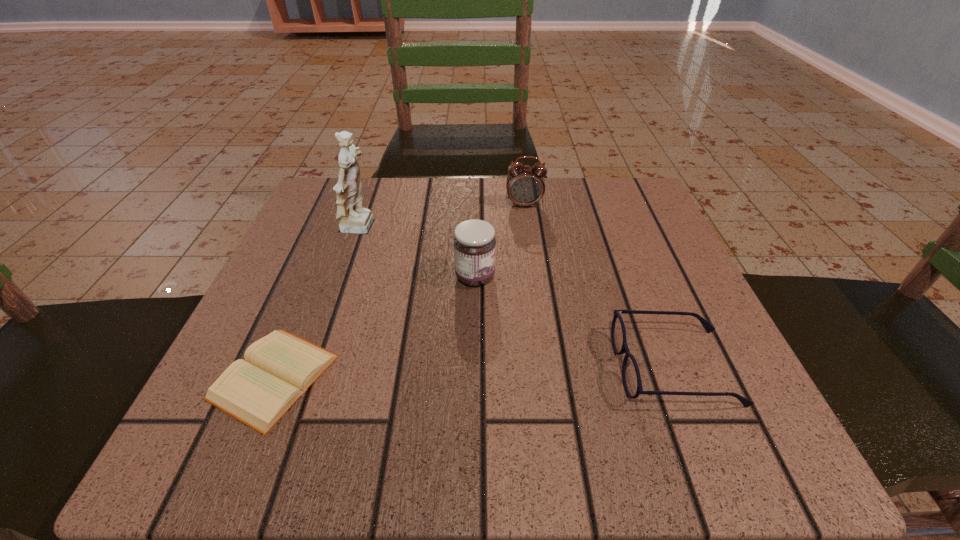
Locate an element on the screen. Image resolution: width=960 pixels, height=540 pixels. vacant space situated 0.250m on the face of the alarm clock is located at coordinates (536, 290).

You are a GUI agent. You are given a task and a screenshot of the screen. Output one action in this format:
    pyautogui.click(x=<x>, y=<y>)
    Task: Click on the vacant space located on the front label of the third object from right to left
    
    Given the screenshot: What is the action you would take?
    pyautogui.click(x=640, y=276)

You are a GUI agent. You are given a task and a screenshot of the screen. Output one action in this format:
    pyautogui.click(x=<x>, y=<y>)
    Task: Click on the vacant space situated on the front-facing side of the spectacles
    The width and height of the screenshot is (960, 540).
    Given the screenshot: What is the action you would take?
    pyautogui.click(x=364, y=367)

The height and width of the screenshot is (540, 960). Find the location of `vacant space located on the front-facing side of the spectacles`. vacant space located on the front-facing side of the spectacles is located at coordinates (556, 367).

Locate an element on the screen. This screenshot has height=540, width=960. free space located on the front-facing side of the spectacles is located at coordinates (488, 367).

Where is `free space located on the right of the shortest object`? This screenshot has width=960, height=540. free space located on the right of the shortest object is located at coordinates (368, 377).

Identify the location of figurine present at the far edge. The height and width of the screenshot is (540, 960). (353, 218).

At what (x,y) coordinates should I click in order to perform the action: click on alarm clock at the far edge. Please return your answer as a coordinate pair (x, y). Looking at the image, I should click on (525, 185).

Find the location of a particular element. The image size is (960, 540). spectacles positioned at the near edge is located at coordinates (631, 378).

The image size is (960, 540). I want to click on diary that is positioned at the near edge, so click(x=279, y=368).